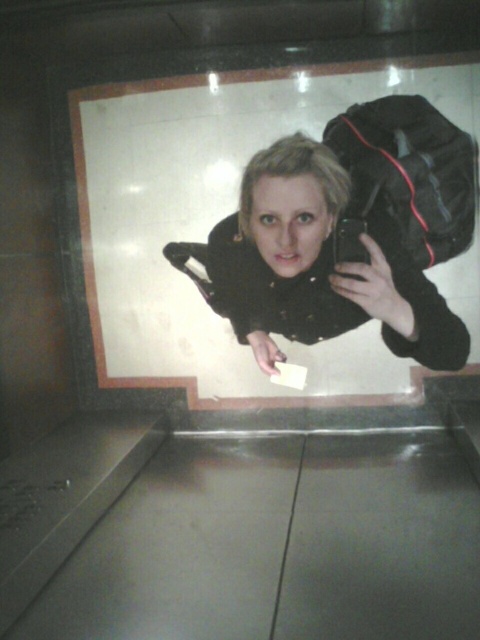
In the scene shown: You are standing in front of a reflective surface and see the matte black jacket at center. If you want to avoid your reflection overlapping with the jacket, where should you position yourself relative to the jacket?

The matte black jacket at center is located at point (320, 266). To avoid your reflection overlapping with it, you should position yourself to the left or right of the jacket, or move forward or backward to adjust the reflection angle.

You are trying to determine which item is taller between the matte black jacket at center and the black fabric bag at upper right. Based on the scene described, which one is taller?

The matte black jacket at center is taller than the black fabric bag at upper right according to the description.

You are trying to determine which item is bigger between the matte black jacket at center and the black fabric bag at upper right. Based on the scene, which one is larger?

The matte black jacket at center is larger in size than the black fabric bag at upper right.